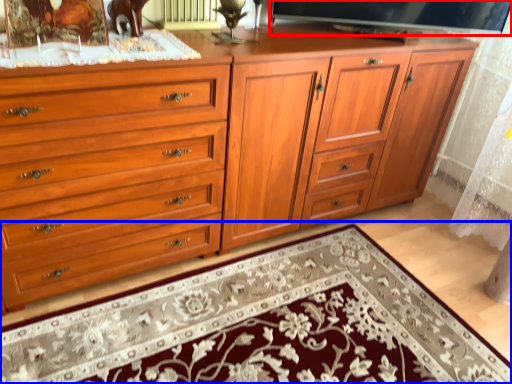
Question: Among these objects, which one is nearest to the camera, television (highlighted by a red box) or mat (highlighted by a blue box)?

Choices:
 (A) television
 (B) mat

Answer: (B)